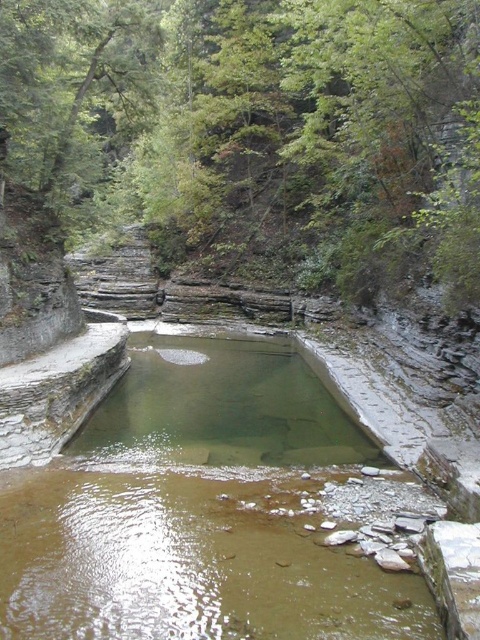
You are standing at the edge of the clear stone pool at center and want to reach the green leafy tree at upper center. If your maximum walking distance is 30 feet, can you reach the tree without getting tired?

The distance between the green leafy tree at upper center and the clear stone pool at center is 40.06 feet, which exceeds your 30 feet walking limit. Therefore, you cannot reach the tree without getting tired.

You are standing in the canyon and want to take a photo of the green leafy tree at upper center and the clear stone pool at center. Which object should you focus on first to ensure both are in focus?

You should focus on the green leafy tree at upper center first because it is closer to you than the clear stone pool at center, so focusing on the closer object will help both be in focus.

You are standing at the edge of the pool and see a point marked at coordinates (257, 131). What object is located at that point?

The point at coordinates (257, 131) indicates a green leafy tree at upper center.